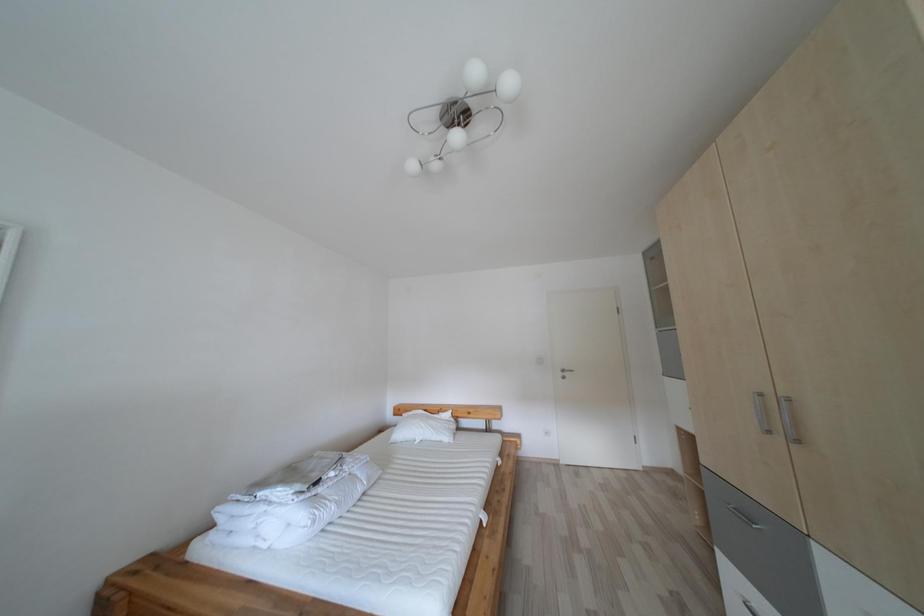
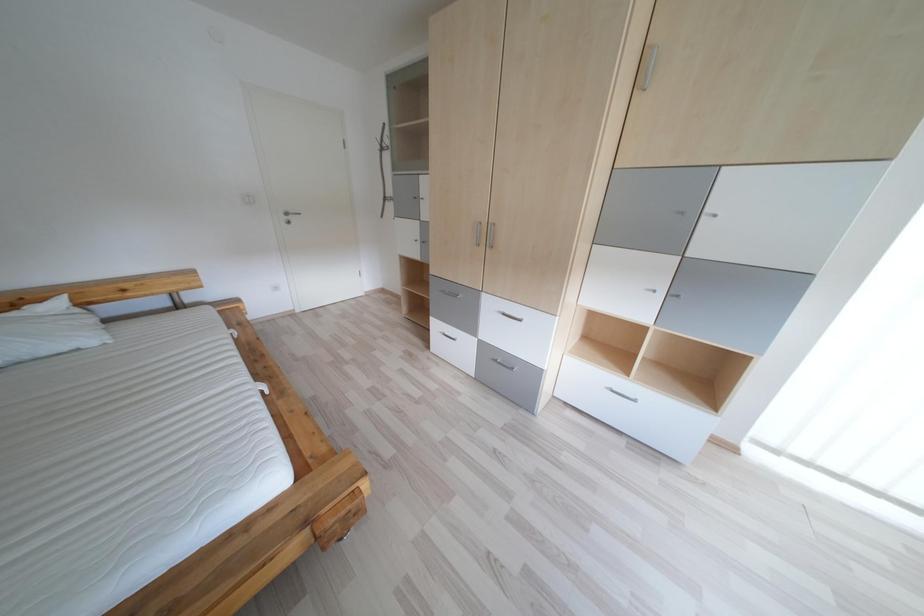
First-person continuous shooting, in which direction is the camera rotating?

The rotation direction of the camera is right-down.